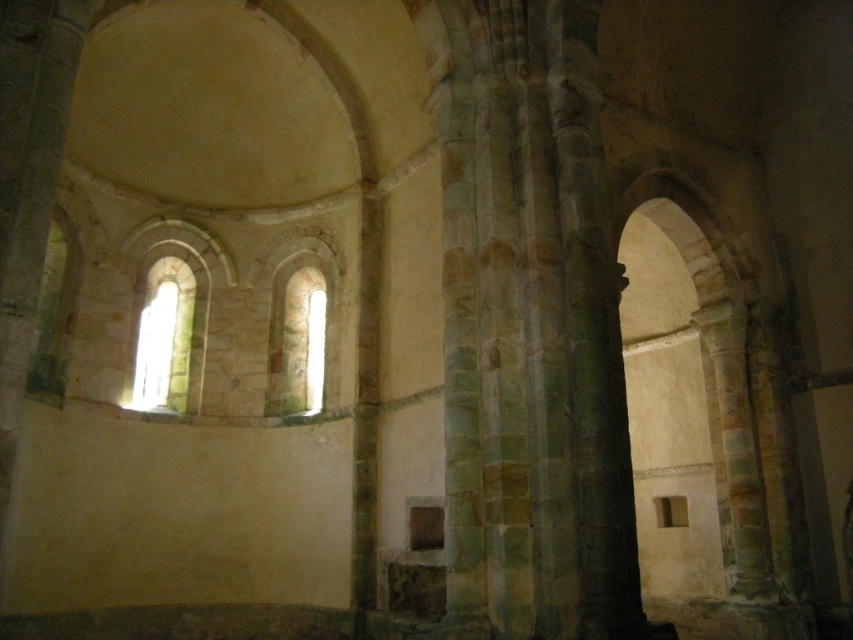
Where is `translucent stone window at left`? The height and width of the screenshot is (640, 853). translucent stone window at left is located at coordinates (170, 336).

Can you confirm if translucent stone window at left is positioned below translucent glass window at center?

No.

At what (x,y) coordinates should I click in order to perform the action: click on translucent stone window at left. Please return your answer as a coordinate pair (x, y). Looking at the image, I should click on (170, 336).

From the picture: Does translucent stone window at center have a lesser width compared to translucent glass window at center?

Incorrect, translucent stone window at center's width is not less than translucent glass window at center's.

Which is in front, point (318, 324) or point (167, 381)?

Positioned in front is point (167, 381).

Image resolution: width=853 pixels, height=640 pixels. In order to click on translucent stone window at center in this screenshot , I will do `click(296, 339)`.

Is translucent stone window at left smaller than translucent stone window at center?

Actually, translucent stone window at left might be larger than translucent stone window at center.

Is translucent stone window at left bigger than translucent stone window at center?

Yes, translucent stone window at left is bigger than translucent stone window at center.

Describe the element at coordinates (170, 336) in the screenshot. The width and height of the screenshot is (853, 640). I see `translucent stone window at left` at that location.

Locate an element on the screen. This screenshot has height=640, width=853. translucent stone window at left is located at coordinates (170, 336).